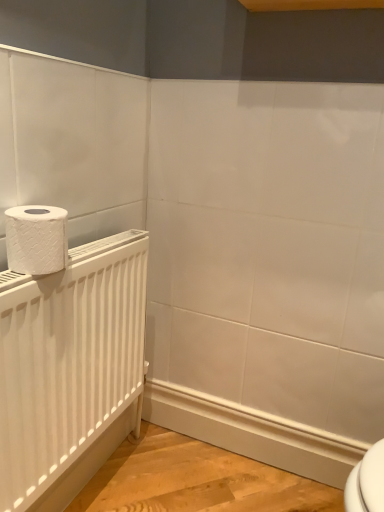
Question: From a real-world perspective, is white textured toilet paper at left physically located above or below white matte radiator at left?

Choices:
 (A) above
 (B) below

Answer: (A)

Question: Would you say white textured toilet paper at left is to the left or to the right of white matte radiator at left in the picture?

Choices:
 (A) right
 (B) left

Answer: (B)

Question: Is white textured toilet paper at left in front of or behind white matte radiator at left in the image?

Choices:
 (A) behind
 (B) front

Answer: (A)

Question: Does point (28, 488) appear closer or farther from the camera than point (26, 224)?

Choices:
 (A) closer
 (B) farther

Answer: (B)

Question: Visually, is white matte radiator at left positioned to the left or to the right of white textured toilet paper at left?

Choices:
 (A) left
 (B) right

Answer: (B)

Question: Based on their sizes in the image, would you say white matte radiator at left is bigger or smaller than white textured toilet paper at left?

Choices:
 (A) small
 (B) big

Answer: (B)

Question: From a real-world perspective, relative to white textured toilet paper at left, is white matte radiator at left vertically above or below?

Choices:
 (A) above
 (B) below

Answer: (B)